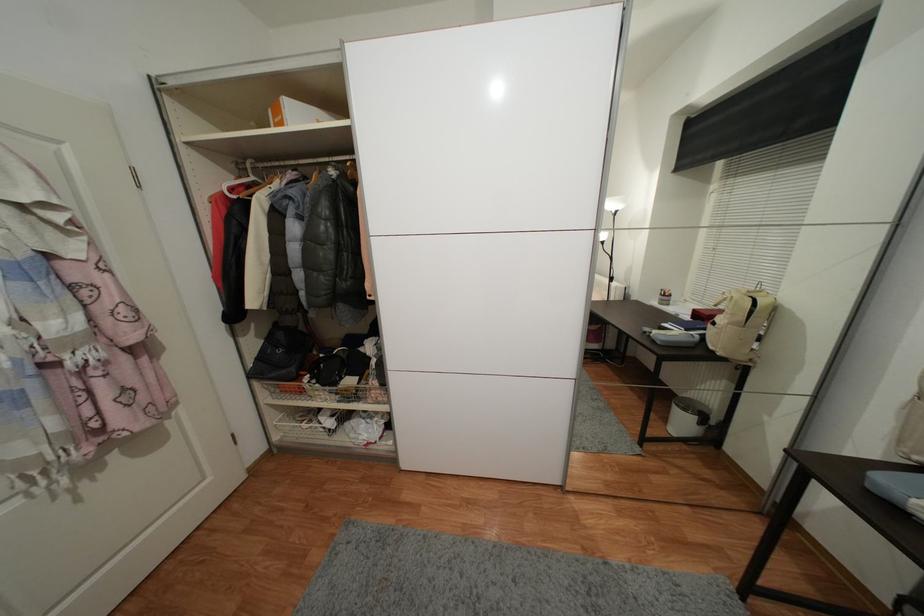
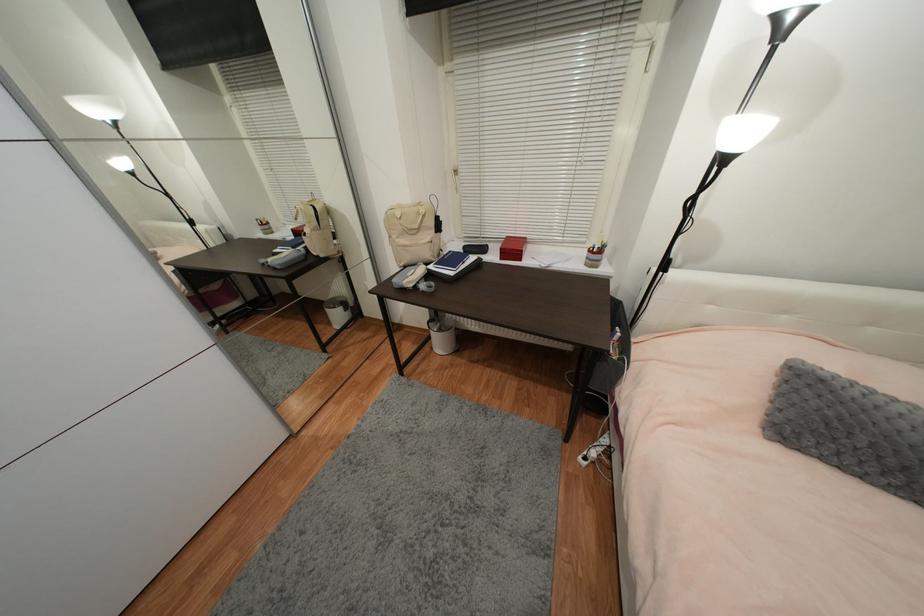
The first image is from the beginning of the video and the second image is from the end. How did the camera likely rotate when shooting the video?

The rotation direction of the camera is right-down.